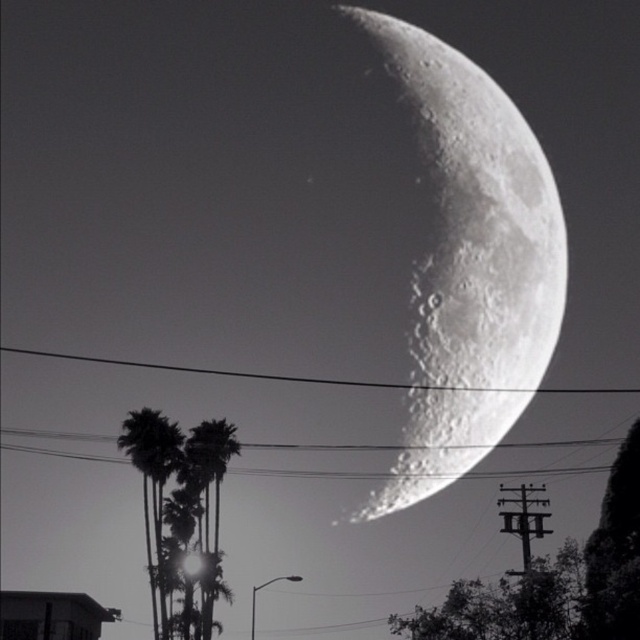
In the celestial scene with the crescent moon and palm trees, there is a point labeled as point (208, 497). Which object does this point correspond to?

The point (208, 497) corresponds to the green leafy palm tree at center.

You are an astronaut on a distant planet observing the moon and two palm trees in the foreground. The silhouette palm trees at lower left and the green leafy palm tree at center are both visible. Which of these two palm trees is wider?

The silhouette palm trees at lower left is wider than the green leafy palm tree at center, as the silhouette palm trees at lower left has a greater width according to the description.